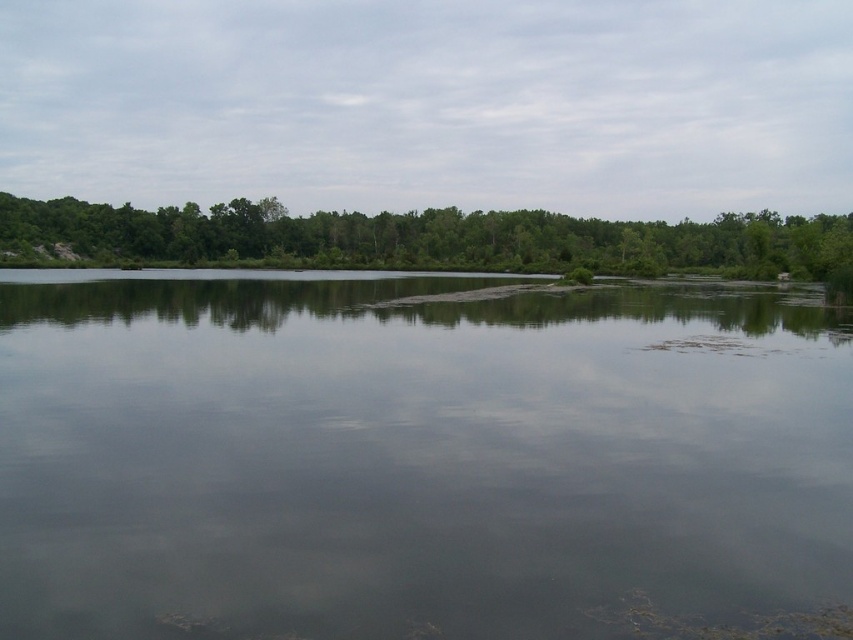
You are standing at the lakeside and want to know if the transparent water at center is wider than the green leafy trees at upper center. Based on the scene, can you determine which one is wider?

The transparent water at center is less wide than the green leafy trees at upper center, so the green leafy trees at upper center are wider.